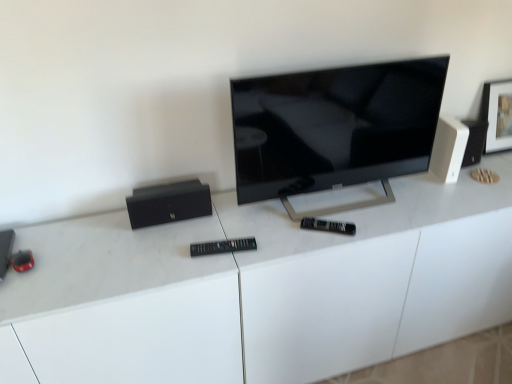
I want to click on vacant area located to the right-hand side of black matte speaker at left, marked as the second speaker in a bottom-to-top arrangement, so click(227, 220).